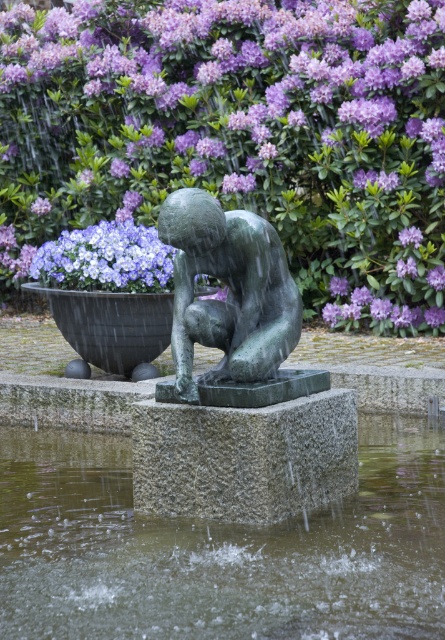
Question: Considering the real-world distances, which object is closest to the green polished stone statue at center?

Choices:
 (A) purple matte flower at upper left
 (B) clear water at fountain center

Answer: (B)

Question: Is green polished stone statue at center in front of matte green statue at center?

Choices:
 (A) no
 (B) yes

Answer: (B)

Question: Does purple matte flowers at upper center come in front of purple matte flower at upper left?

Choices:
 (A) yes
 (B) no

Answer: (A)

Question: Considering the real-world distances, which object is closest to the purple matte flower at upper left?

Choices:
 (A) green polished stone statue at center
 (B) purple matte flowers at upper center
 (C) clear water at fountain center

Answer: (B)

Question: Is purple matte flowers at upper center closer to camera compared to matte green statue at center?

Choices:
 (A) no
 (B) yes

Answer: (A)

Question: Based on their relative distances, which object is farther from the clear water at fountain center?

Choices:
 (A) green polished stone statue at center
 (B) purple matte flowers at upper center

Answer: (B)